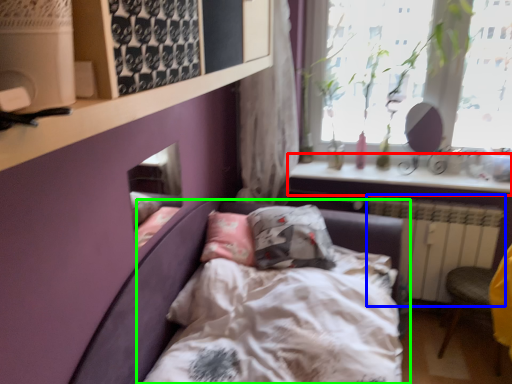
Question: Which is nearer to the window sill (highlighted by a red box)? radiator (highlighted by a blue box) or bed (highlighted by a green box).

Choices:
 (A) radiator
 (B) bed

Answer: (A)